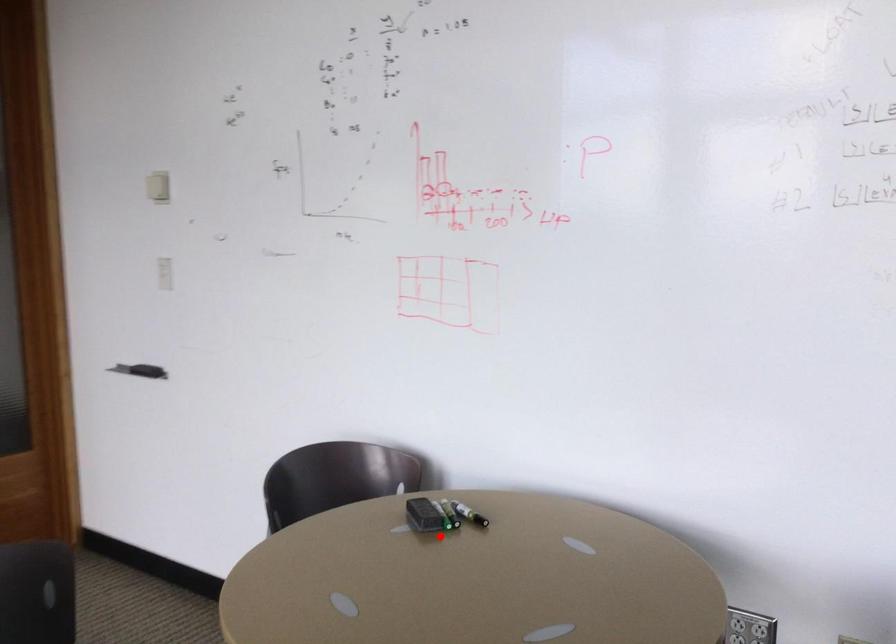
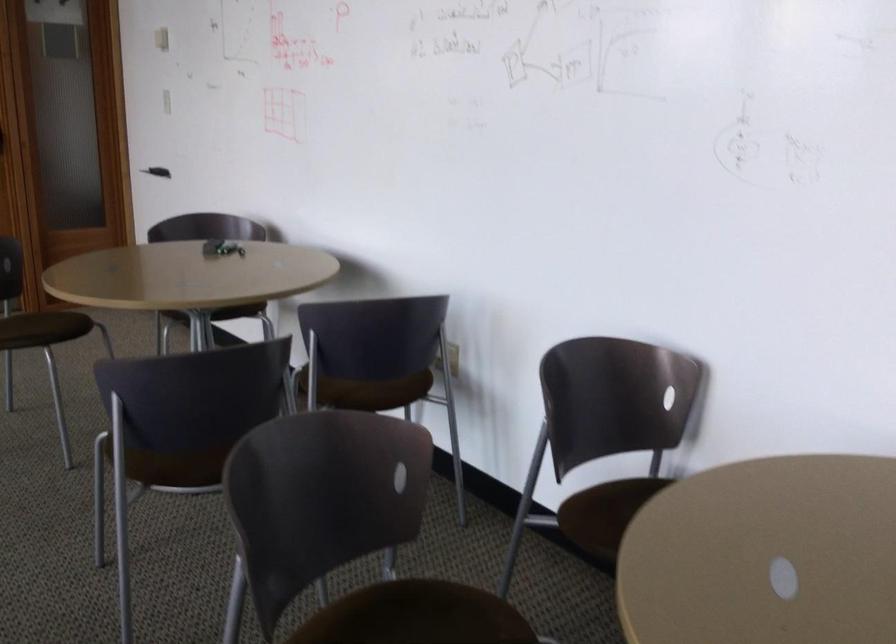
Question: A red point is marked in image1. In image2, is the corresponding 3D point closer to the camera or farther? Reply with the corresponding letter.

Choices:
 (A) The corresponding 3D point is closer.
 (B) The corresponding 3D point is farther.

Answer: (B)